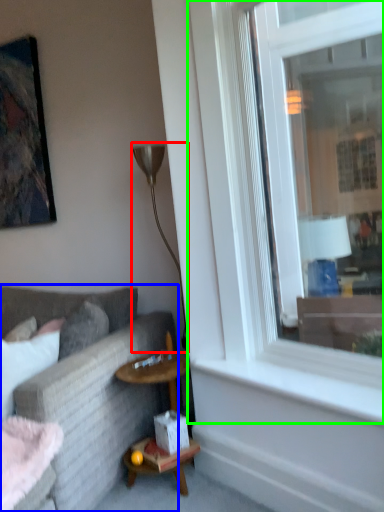
Question: Considering the real-world distances, which object is farthest from lamp (highlighted by a red box)? studio couch (highlighted by a blue box) or window (highlighted by a green box)?

Choices:
 (A) studio couch
 (B) window

Answer: (B)